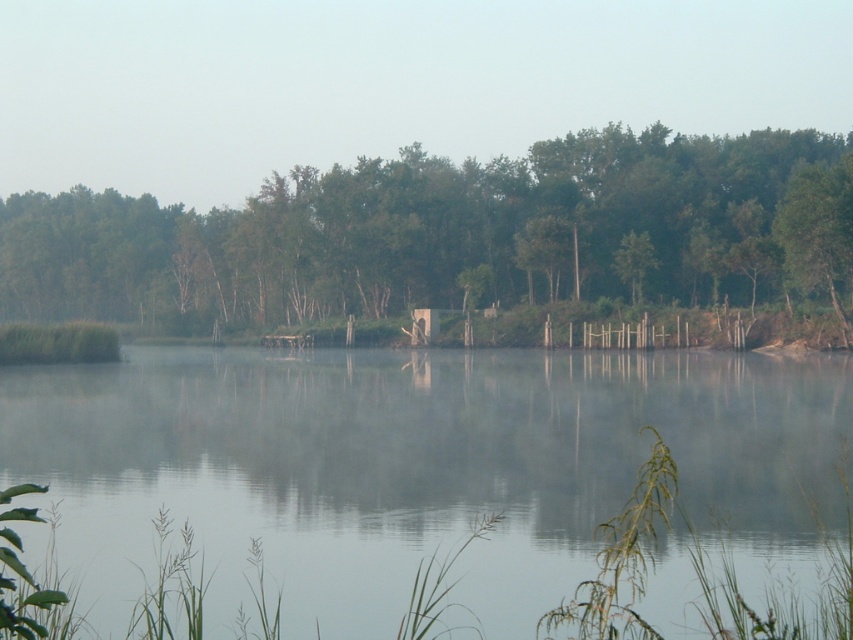
Question: Among these objects, which one is farthest from the camera?

Choices:
 (A) transparent water at center
 (B) green matte tree at center

Answer: (B)

Question: Does transparent water at center appear on the right side of green matte tree at center?

Choices:
 (A) yes
 (B) no

Answer: (A)

Question: Which point is farther to the camera?

Choices:
 (A) (26, 257)
 (B) (193, 480)

Answer: (A)

Question: In this image, where is transparent water at center located relative to green matte tree at center?

Choices:
 (A) right
 (B) left

Answer: (A)

Question: Can you confirm if transparent water at center is wider than green matte tree at center?

Choices:
 (A) no
 (B) yes

Answer: (A)